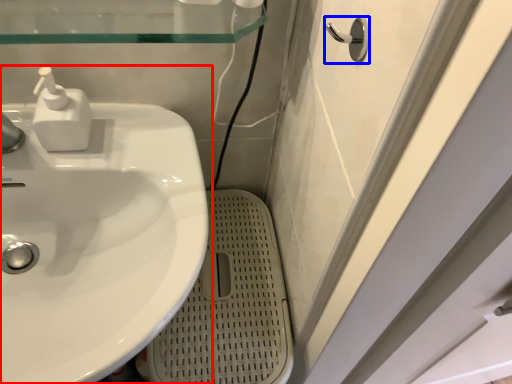
Question: Among these objects, which one is nearest to the camera, sink (highlighted by a red box) or door handle (highlighted by a blue box)?

Choices:
 (A) sink
 (B) door handle

Answer: (B)